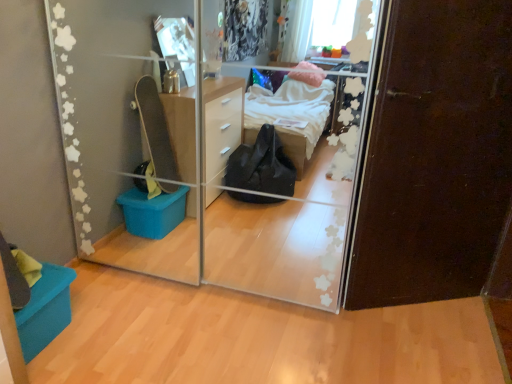
Question: Can you confirm if transparent glass door at center is thinner than dark brown wood door at right?

Choices:
 (A) no
 (B) yes

Answer: (A)

Question: Is dark brown wood door at right at the back of transparent glass door at center?

Choices:
 (A) yes
 (B) no

Answer: (B)

Question: From the image's perspective, is transparent glass door at center over dark brown wood door at right?

Choices:
 (A) yes
 (B) no

Answer: (A)

Question: Is transparent glass door at center further to camera compared to dark brown wood door at right?

Choices:
 (A) yes
 (B) no

Answer: (B)

Question: Is transparent glass door at center bigger than dark brown wood door at right?

Choices:
 (A) no
 (B) yes

Answer: (B)

Question: In terms of width, does transparent glass door at center look wider or thinner when compared to teal fabric storage box at lower left?

Choices:
 (A) thin
 (B) wide

Answer: (B)

Question: Based on their sizes in the image, would you say transparent glass door at center is bigger or smaller than teal fabric storage box at lower left?

Choices:
 (A) big
 (B) small

Answer: (A)

Question: From their relative heights in the image, would you say transparent glass door at center is taller or shorter than teal fabric storage box at lower left?

Choices:
 (A) tall
 (B) short

Answer: (A)

Question: From a real-world perspective, is transparent glass door at center physically located above or below teal fabric storage box at lower left?

Choices:
 (A) above
 (B) below

Answer: (A)

Question: Is dark brown wood door at right taller or shorter than transparent glass door at center?

Choices:
 (A) tall
 (B) short

Answer: (A)

Question: Is point (464, 11) positioned closer to the camera than point (165, 96)?

Choices:
 (A) farther
 (B) closer

Answer: (B)

Question: Is dark brown wood door at right inside or outside of transparent glass door at center?

Choices:
 (A) inside
 (B) outside

Answer: (B)

Question: Is dark brown wood door at right to the left or to the right of transparent glass door at center in the image?

Choices:
 (A) right
 (B) left

Answer: (A)

Question: Looking at the image, does dark brown wood door at right seem bigger or smaller compared to teal fabric storage box at lower left?

Choices:
 (A) big
 (B) small

Answer: (A)

Question: In terms of width, does dark brown wood door at right look wider or thinner when compared to teal fabric storage box at lower left?

Choices:
 (A) wide
 (B) thin

Answer: (B)